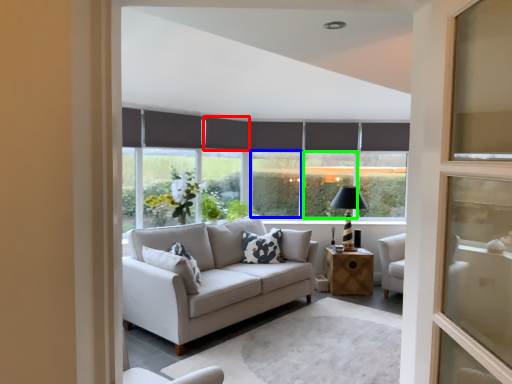
Question: Based on their relative distances, which object is farther from curtain (highlighted by a red box)? Choose from window (highlighted by a blue box) and window (highlighted by a green box).

Choices:
 (A) window
 (B) window

Answer: (B)